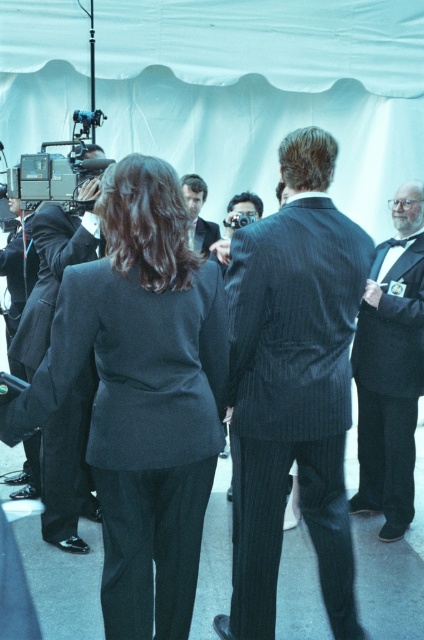
You are standing at the position of point (201, 193) and want to see if you can see the person at point (86, 141). Since the scene is slightly overexposed, does the brightness affect your visibility?

The brightness of the scene does not affect visibility between point (86, 141) and point (201, 193) because the overexposure is a general characteristic of the image and does not block the line of sight between the two points.

You are a photographer at the event and need to position yourself to capture a shot of the matte black video camera at left without blocking the foreground individuals. Based on its coordinates, where should you position yourself relative to the camera?

The matte black video camera at left is located at point (58,168), so positioning yourself to the right of the camera would allow you to capture it without obstructing the foreground individuals.

You are standing at the center of the image and want to move towards the point marked as point (67, 467). Which direction should you move to reach it?

The point (67, 467) is on the matte black suit at left, so you should move towards the left direction to reach it.